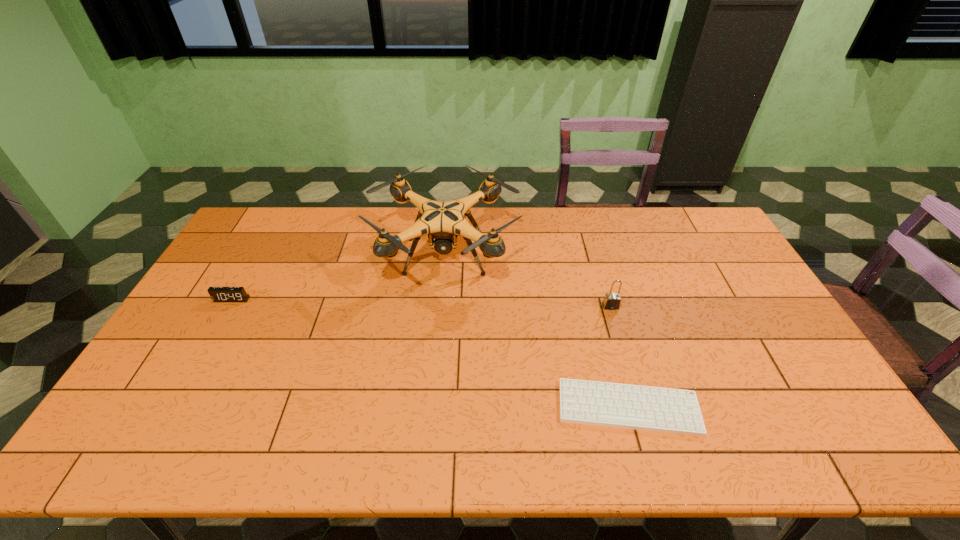
The height and width of the screenshot is (540, 960). What are the coordinates of `vacant region between the tallest object and the padlock` in the screenshot? It's located at (528, 281).

Locate an element on the screen. The image size is (960, 540). free space between the computer keyboard and the second shortest object is located at coordinates (430, 354).

This screenshot has height=540, width=960. I want to click on free space between the nearest object and the leftmost object, so (430, 354).

The image size is (960, 540). I want to click on unoccupied position between the shortest object and the third shortest object, so click(619, 357).

Where is `vacant region between the drone and the padlock`? This screenshot has width=960, height=540. vacant region between the drone and the padlock is located at coordinates (528, 281).

Locate an element on the screen. This screenshot has height=540, width=960. free space between the tallest object and the alarm clock is located at coordinates (339, 278).

Find the location of a particular element. The width and height of the screenshot is (960, 540). unoccupied area between the leftmost object and the drone is located at coordinates (339, 278).

Find the location of a particular element. Image resolution: width=960 pixels, height=540 pixels. free area in between the shortest object and the second tallest object is located at coordinates (619, 357).

Locate an element on the screen. The width and height of the screenshot is (960, 540). the second closest object relative to the third tallest object is located at coordinates (666, 410).

Locate which object is the closest to the shortest object. Please provide its 2D coordinates. Your answer should be formatted as a tuple, i.e. [(x, y)], where the tuple contains the x and y coordinates of a point satisfying the conditions above.

[(611, 301)]